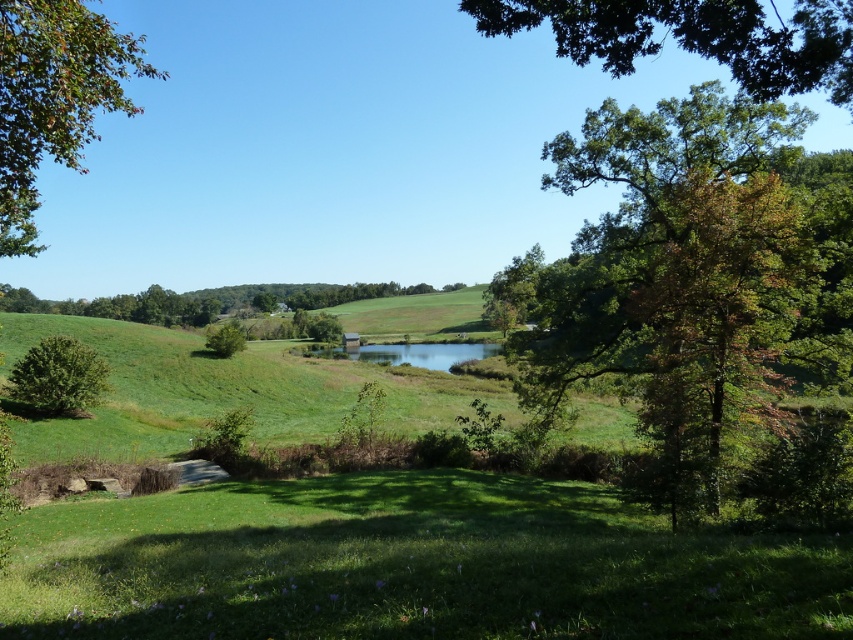
Question: Which object appears closest to the camera in this image?

Choices:
 (A) green leafy tree at center
 (B) green leafy tree at upper right
 (C) green grassy field at center

Answer: (B)

Question: Considering the real-world distances, which object is farthest from the green leafy tree at center?

Choices:
 (A) green grassy field at center
 (B) green matte tree at lower left
 (C) green leafy tree at right
 (D) green leafy tree at upper right

Answer: (A)

Question: Which object is farther from the camera taking this photo?

Choices:
 (A) green leafy tree at upper right
 (B) green leafy tree at upper left
 (C) green matte tree at lower left

Answer: (C)

Question: Is green grassy field at center smaller than green matte tree at lower left?

Choices:
 (A) yes
 (B) no

Answer: (B)

Question: Can you confirm if green matte tree at lower left is thinner than green leafy tree at center?

Choices:
 (A) yes
 (B) no

Answer: (A)

Question: Does green leafy tree at upper right have a greater width compared to green grassy field at center?

Choices:
 (A) yes
 (B) no

Answer: (B)